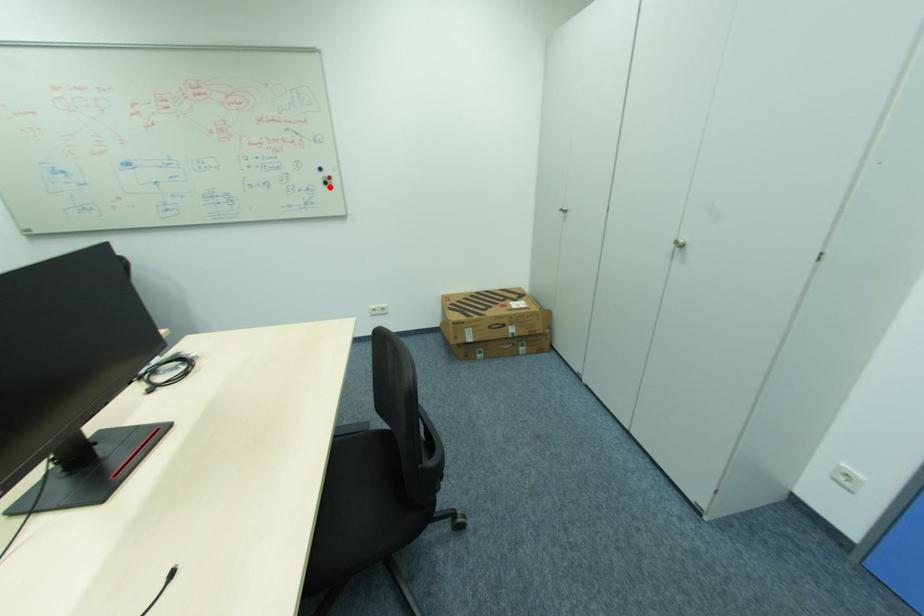
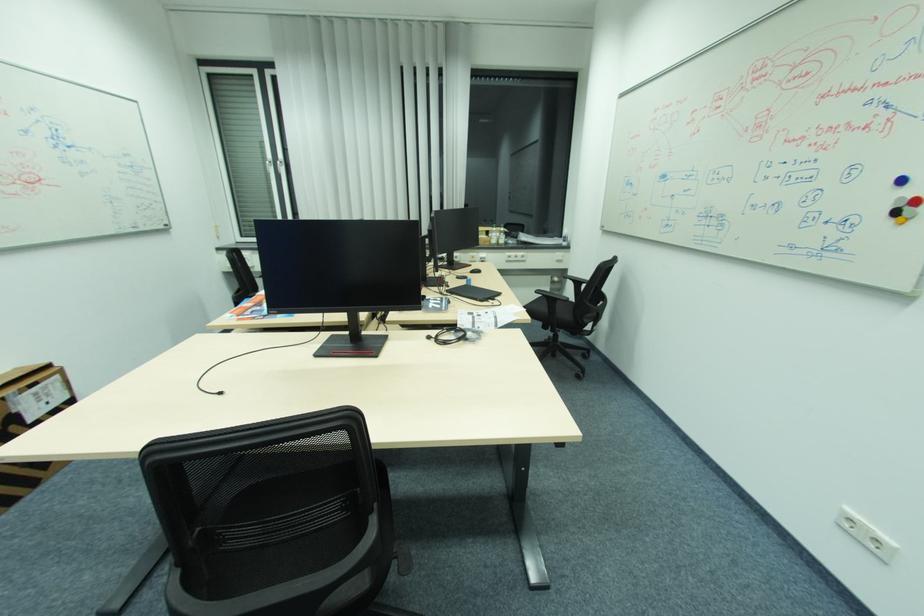
Question: A red point is marked in image1. In image2, is the corresponding 3D point closer to the camera or farther? Reply with the corresponding letter.

Choices:
 (A) The corresponding 3D point is closer.
 (B) The corresponding 3D point is farther.

Answer: (B)